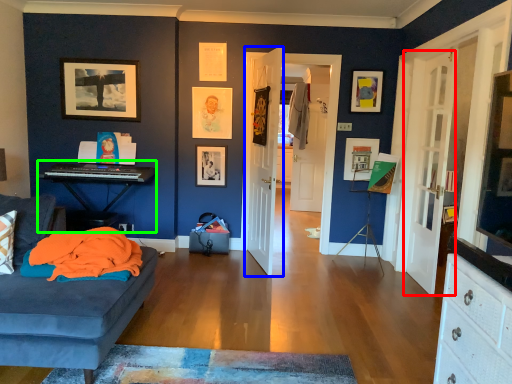
Question: Considering the real-world distances, which object is farthest from door (highlighted by a red box)? door (highlighted by a blue box) or computer desk (highlighted by a green box)?

Choices:
 (A) door
 (B) computer desk

Answer: (B)